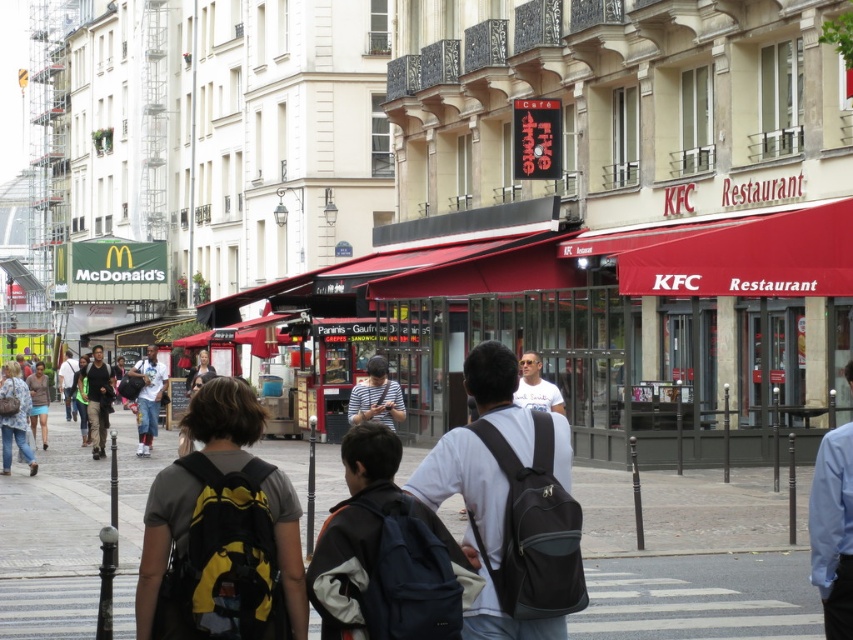
Question: Which object appears closest to the camera in this image?

Choices:
 (A) denim jacket at lower left
 (B) light brown leather jacket at center
 (C) denim shorts at center

Answer: (A)

Question: Does yellow and black backpack at center have a larger size compared to denim shorts at center?

Choices:
 (A) yes
 (B) no

Answer: (B)

Question: Based on their relative distances, which object is nearer to the white t-shirt at center?

Choices:
 (A) smooth concrete pavement at center
 (B) denim jacket at lower left
 (C) yellow and black backpack at center
 (D) striped fabric shirt at center

Answer: (D)

Question: Which point is closer to the camera?

Choices:
 (A) (94, 435)
 (B) (427, 588)
 (C) (824, 540)
 (D) (374, 397)

Answer: (B)

Question: Is black matte backpack at center to the left of denim shorts at center from the viewer's perspective?

Choices:
 (A) no
 (B) yes

Answer: (A)

Question: Can you confirm if smooth concrete pavement at center is smaller than striped fabric shirt at center?

Choices:
 (A) no
 (B) yes

Answer: (A)